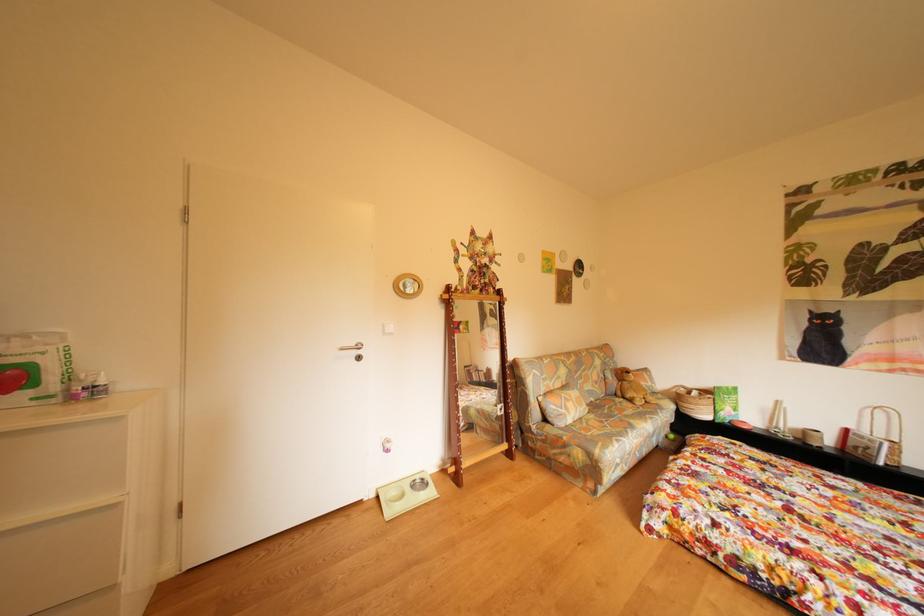
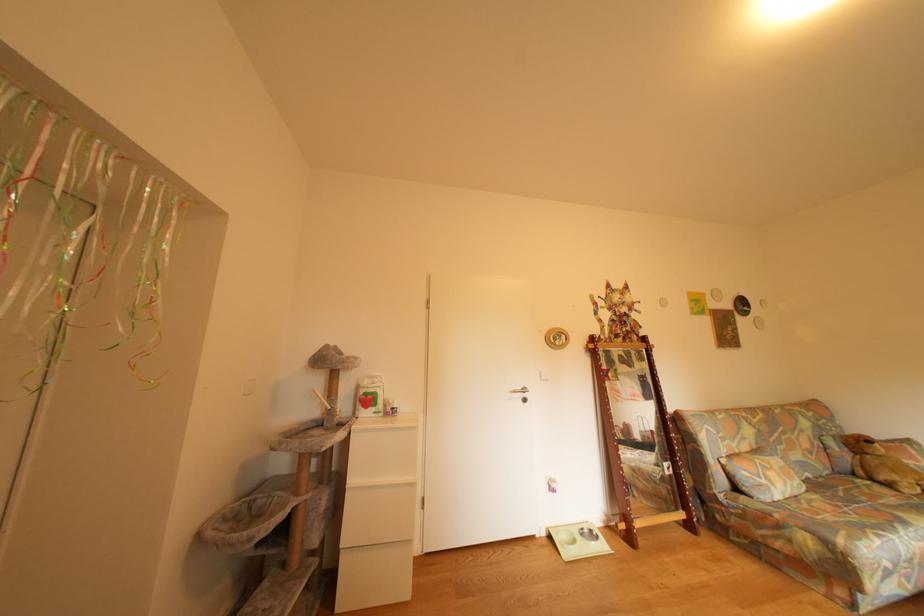
Question: The camera is either moving clockwise (left) or counter-clockwise (right) around the object. The first image is from the beginning of the video and the second image is from the end. Is the camera moving left or right when shooting the video?

Choices:
 (A) Left
 (B) Right

Answer: (B)